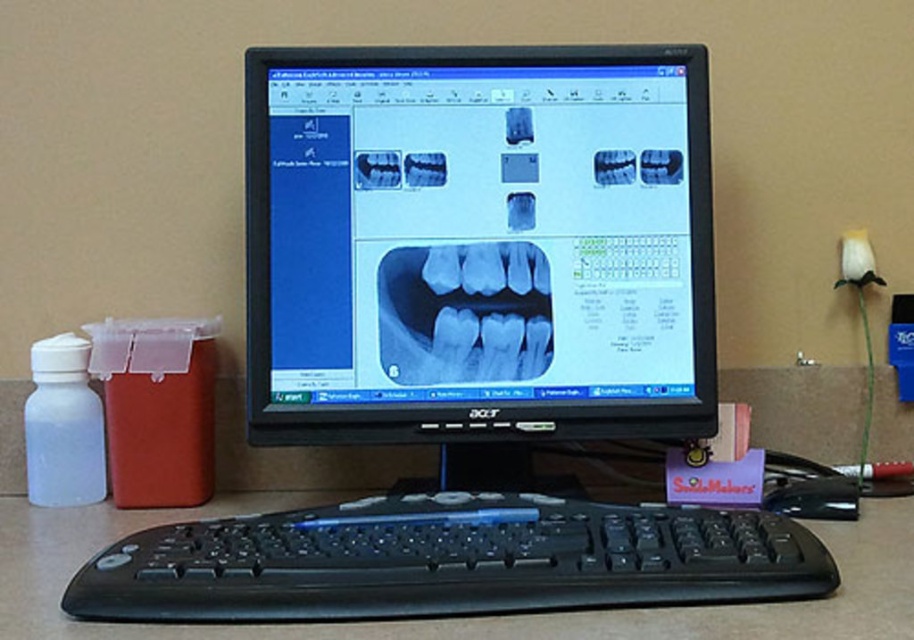
Between point (707, 104) and point (40, 477), which one is positioned in front?

Point (707, 104) is in front.

This screenshot has height=640, width=914. What do you see at coordinates (477, 243) in the screenshot?
I see `matte black monitor at center` at bounding box center [477, 243].

The image size is (914, 640). Find the location of `matte black monitor at center`. matte black monitor at center is located at coordinates (477, 243).

Which is more to the left, black plastic keyboard at center or black plastic mouse at lower right?

black plastic keyboard at center is more to the left.

Is black plastic keyboard at center smaller than black plastic mouse at lower right?

No.

Is point (615, 579) positioned after point (785, 502)?

No, (615, 579) is in front of (785, 502).

Locate an element on the screen. black plastic keyboard at center is located at coordinates coord(448,561).

Is black plastic keyboard at center shorter than blue x-ray film at center?

Yes, black plastic keyboard at center is shorter than blue x-ray film at center.

Who is positioned more to the left, black plastic keyboard at center or blue x-ray film at center?

black plastic keyboard at center is more to the left.

I want to click on black plastic keyboard at center, so click(448, 561).

Find the location of a particular element. This screenshot has width=914, height=640. black plastic keyboard at center is located at coordinates (448, 561).